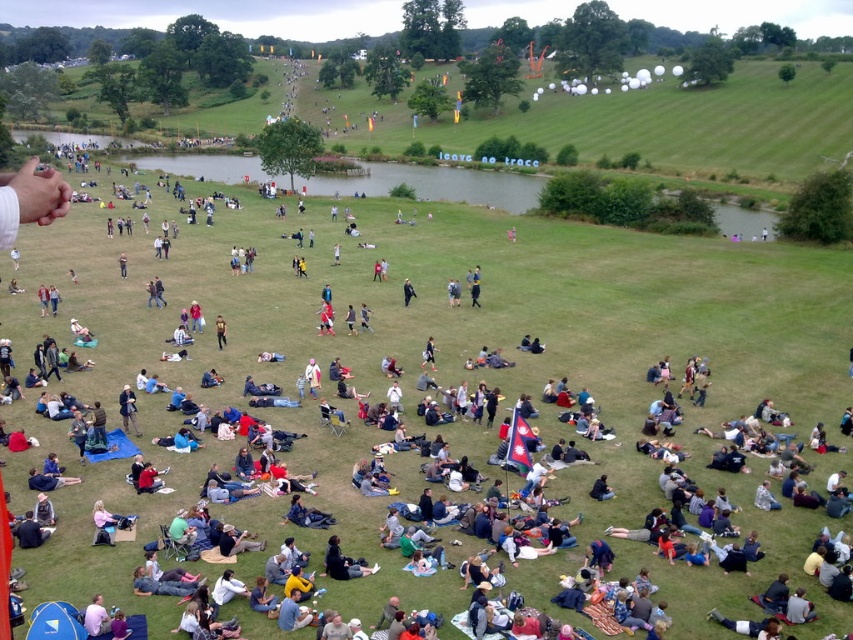
Question: Can you confirm if dark blue fabric jacket at center is thinner than brown leather jacket at center?

Choices:
 (A) yes
 (B) no

Answer: (B)

Question: Does dark blue fabric jacket at center appear under brown leather jacket at center?

Choices:
 (A) yes
 (B) no

Answer: (A)

Question: Among these points, which one is nearest to the camera?

Choices:
 (A) (125, 396)
 (B) (219, 339)

Answer: (A)

Question: Does dark blue fabric jacket at center have a lesser width compared to brown leather jacket at center?

Choices:
 (A) no
 (B) yes

Answer: (A)